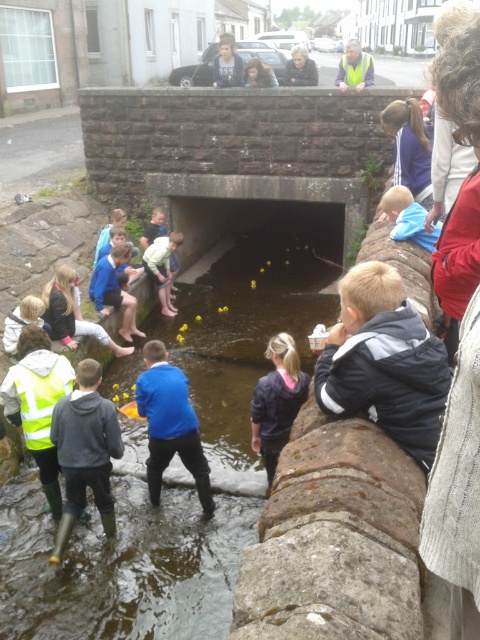
You are a safety inspector checking the scene. You notice the yellow reflective vest at lower left. Where exactly is it positioned in the image coordinates?

The yellow reflective vest at lower left is located at point coordinates of 0.631 on the x axis and 0.079 on the y axis.

You are a safety inspector observing the scene. You notice the yellow reflective vest at lower left and the smooth plastic head at upper center. Which object is positioned higher from the ground?

The yellow reflective vest at lower left is much taller than the smooth plastic head at upper center, so the yellow reflective vest at lower left is positioned higher from the ground.

You are a parent supervising children playing near the waterway. You notice the yellow rubber ducks at center and the yellow reflective vest at upper center. Which object is closer to the water surface?

The yellow rubber ducks at center are closer to the water surface than the yellow reflective vest at upper center because the yellow rubber ducks at center is smaller than yellow reflective vest at upper center.